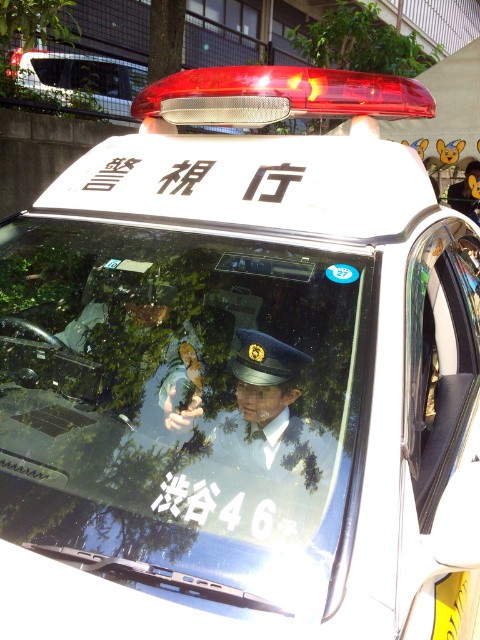
Question: Can you confirm if white glossy sedan at upper left is positioned to the right of matte black uniform at center?

Choices:
 (A) no
 (B) yes

Answer: (A)

Question: Which of the following is the closest to the observer?

Choices:
 (A) white glossy sedan at upper left
 (B) matte black uniform at center

Answer: (B)

Question: Which object appears farthest from the camera in this image?

Choices:
 (A) white glossy sedan at upper left
 (B) uniformed officer at center
 (C) matte black uniform at center

Answer: (A)

Question: Can you confirm if white glossy sedan at upper left is thinner than matte black uniform at center?

Choices:
 (A) no
 (B) yes

Answer: (A)

Question: Among these points, which one is nearest to the camera?

Choices:
 (A) (117, 92)
 (B) (168, 401)

Answer: (B)

Question: Does uniformed officer at center appear on the left side of white glossy sedan at upper left?

Choices:
 (A) no
 (B) yes

Answer: (A)